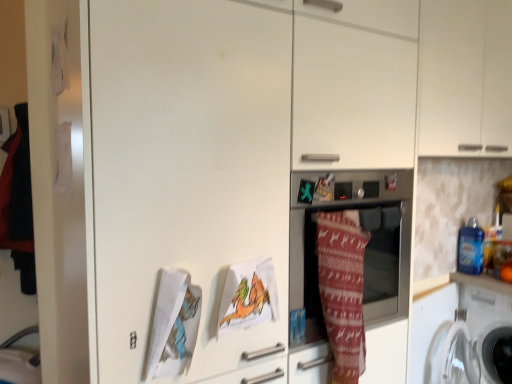
Question: From a real-world perspective, is white matte cabinet at upper right positioned above or below white plastic washing machine at lower right, positioned as the 1th washing machine in right-to-left order?

Choices:
 (A) above
 (B) below

Answer: (A)

Question: From the image's perspective, is white matte cabinet at upper right above or below white plastic washing machine at lower right, positioned as the 1th washing machine in right-to-left order?

Choices:
 (A) above
 (B) below

Answer: (A)

Question: Estimate the real-world distances between objects in this image. Which object is closer to the white plastic washing machine at lower right, the first washing machine positioned from the left?

Choices:
 (A) knitted woolen blanket at center
 (B) metallic oven at center
 (C) white matte cabinet at upper right
 (D) white plastic washing machine at lower right, positioned as the 1th washing machine in right-to-left order

Answer: (D)

Question: Which is farther from the white matte cabinet at upper right?

Choices:
 (A) white plastic washing machine at lower right, the second washing machine when ordered from left to right
 (B) metallic oven at center
 (C) white plastic washing machine at lower right, which is counted as the second washing machine, starting from the right
 (D) knitted woolen blanket at center

Answer: (A)